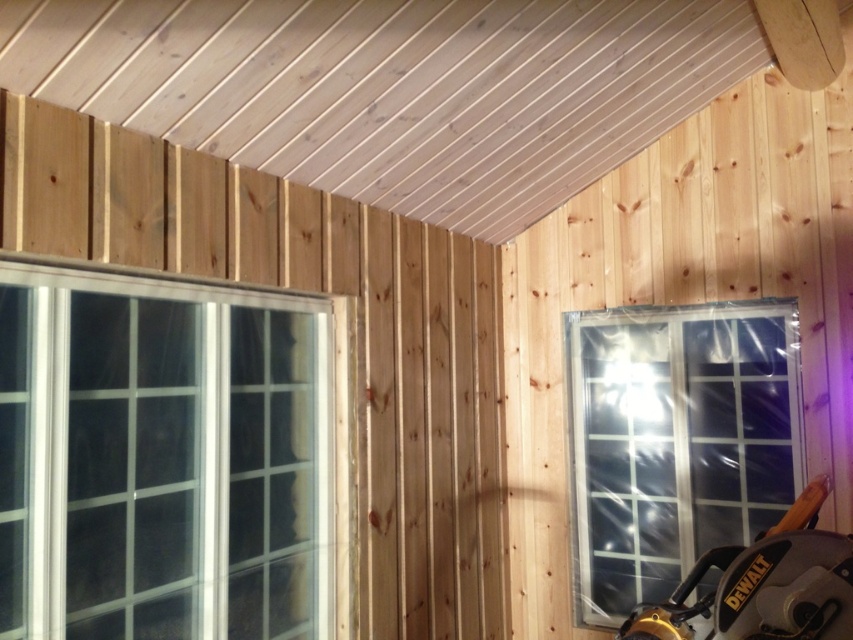
You are an inspector checking the construction site. You need to locate the clear plastic window at center right. Where exactly is it located in the image?

The clear plastic window at center right is located at point coordinates of (675, 442).

You are inside a wooden structure under construction. You see a point marked at coordinates (163,458). Based on the scene description, what object is located at this point?

The point at coordinates (163,458) indicates a clear glass window at left.

Based on the photo, you are a contractor inspecting the wooden structure. You notice the clear plastic window at center right and the black plastic saw at lower right. Which object is wider?

The clear plastic window at center right has a lesser width compared to the black plastic saw at lower right, so the black plastic saw at lower right is wider.